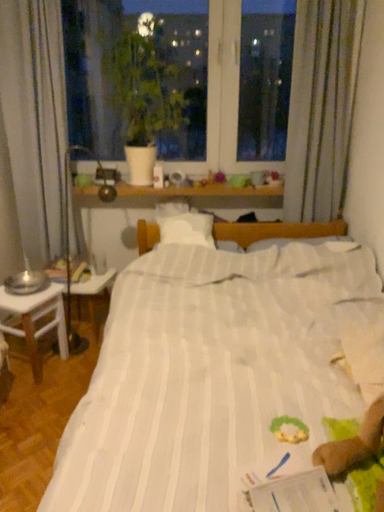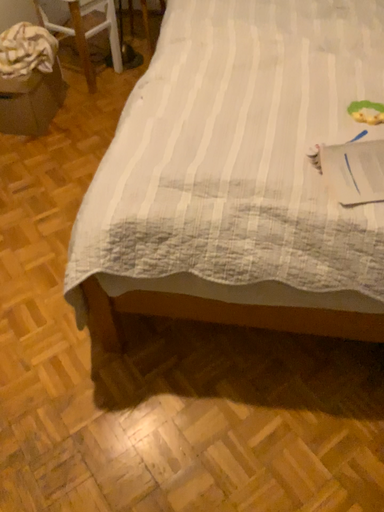
Question: How did the camera likely rotate when shooting the video?

Choices:
 (A) rotated right
 (B) rotated left

Answer: (B)